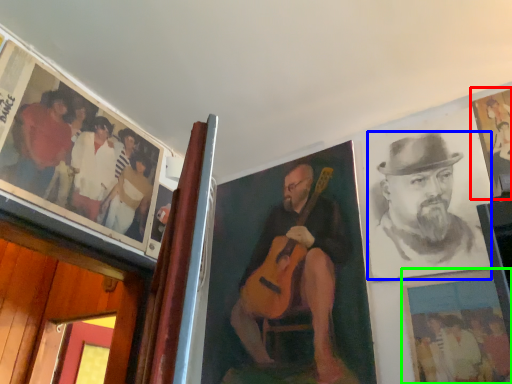
Question: Estimate the real-world distances between objects in this image. Which object is closer to picture frame (highlighted by a red box), man (highlighted by a blue box) or picture frame (highlighted by a green box)?

Choices:
 (A) man
 (B) picture frame

Answer: (A)